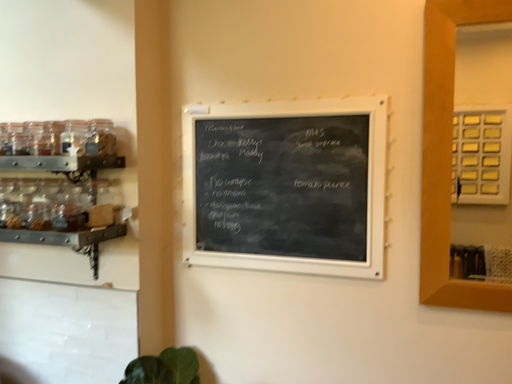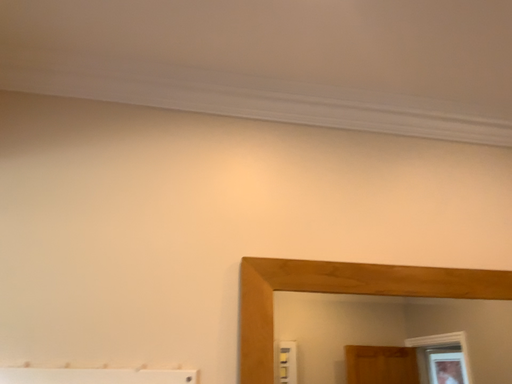
Question: Which way did the camera rotate in the video?

Choices:
 (A) rotated left
 (B) rotated right

Answer: (B)